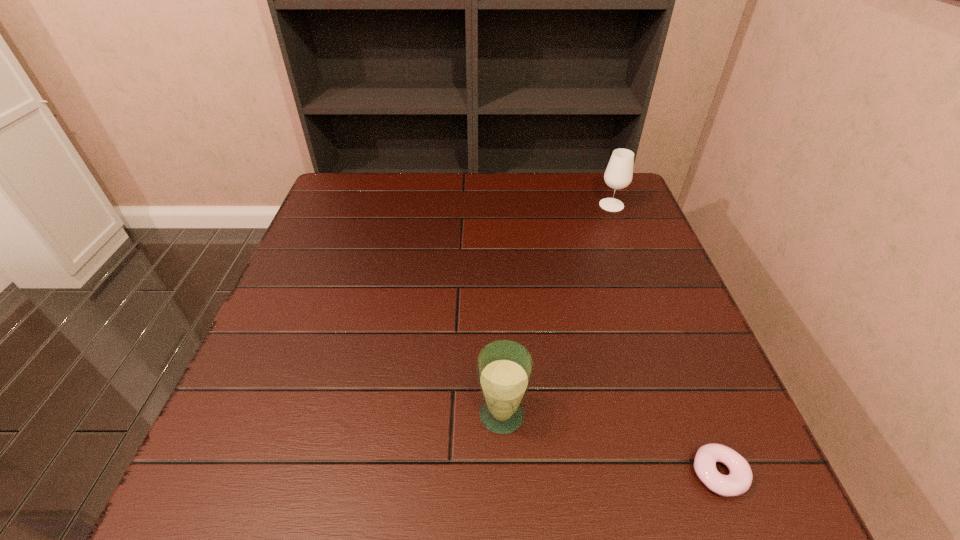
This screenshot has width=960, height=540. I want to click on unoccupied position between the nearest object and the farthest object, so click(x=665, y=339).

Choose which object is the second nearest neighbor to the leftmost object. Please provide its 2D coordinates. Your answer should be formatted as a tuple, i.e. [(x, y)], where the tuple contains the x and y coordinates of a point satisfying the conditions above.

[(618, 175)]

This screenshot has width=960, height=540. I want to click on object that is the closest to the second nearest object, so click(738, 481).

Locate an element on the screen. vacant space that satisfies the following two spatial constraints: 1. on the front side of the nearer glass; 2. on the right side of the doughnut is located at coordinates (504, 474).

The width and height of the screenshot is (960, 540). In order to click on free spot that satisfies the following two spatial constraints: 1. on the back side of the farthest object; 2. on the right side of the nearer glass in this screenshot , I will do `click(493, 205)`.

You are a GUI agent. You are given a task and a screenshot of the screen. Output one action in this format:
    pyautogui.click(x=<x>, y=<y>)
    Task: Click on the free space that satisfies the following two spatial constraints: 1. on the front side of the nearest object; 2. on the right side of the left glass
    The width and height of the screenshot is (960, 540).
    Given the screenshot: What is the action you would take?
    pyautogui.click(x=504, y=474)